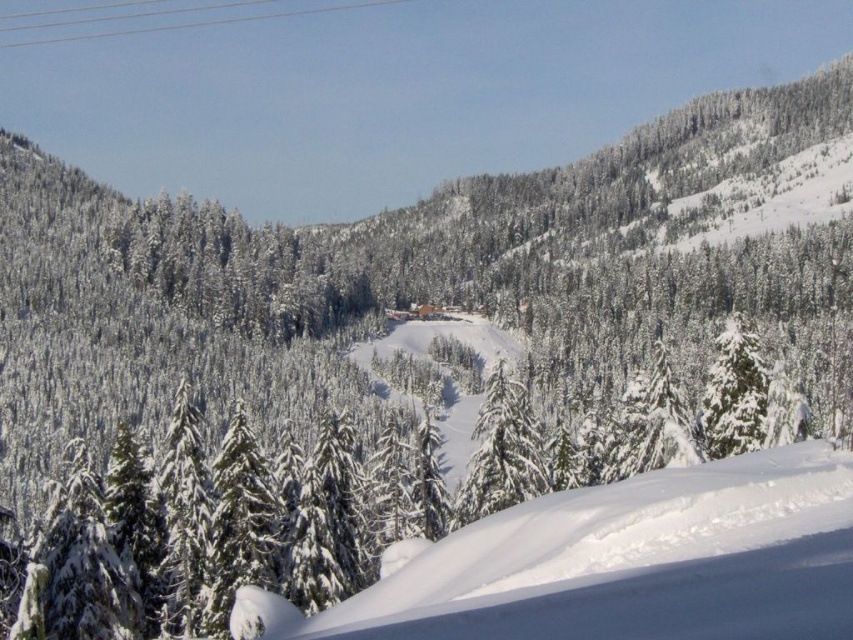
Question: Which of the following is the farthest from the observer?

Choices:
 (A) (x=538, y=554)
 (B) (x=523, y=435)

Answer: (B)

Question: Is white snow ski slope at center positioned before white snow-covered tree at center?

Choices:
 (A) yes
 (B) no

Answer: (A)

Question: Considering the relative positions of white snow ski slope at center and white snow-covered tree at center in the image provided, where is white snow ski slope at center located with respect to white snow-covered tree at center?

Choices:
 (A) above
 (B) below

Answer: (A)

Question: Can you confirm if white snow ski slope at center is wider than white snow-covered tree at center?

Choices:
 (A) no
 (B) yes

Answer: (B)